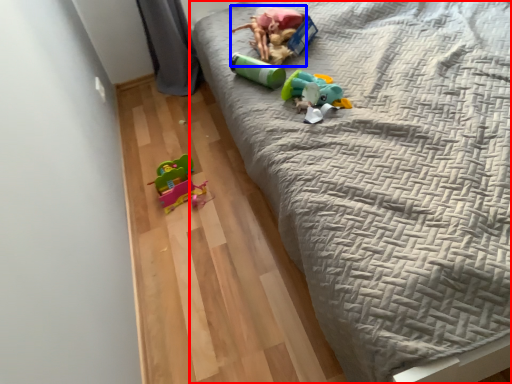
Question: Which object appears farthest to the camera in this image, bed (highlighted by a red box) or toy (highlighted by a blue box)?

Choices:
 (A) bed
 (B) toy

Answer: (B)